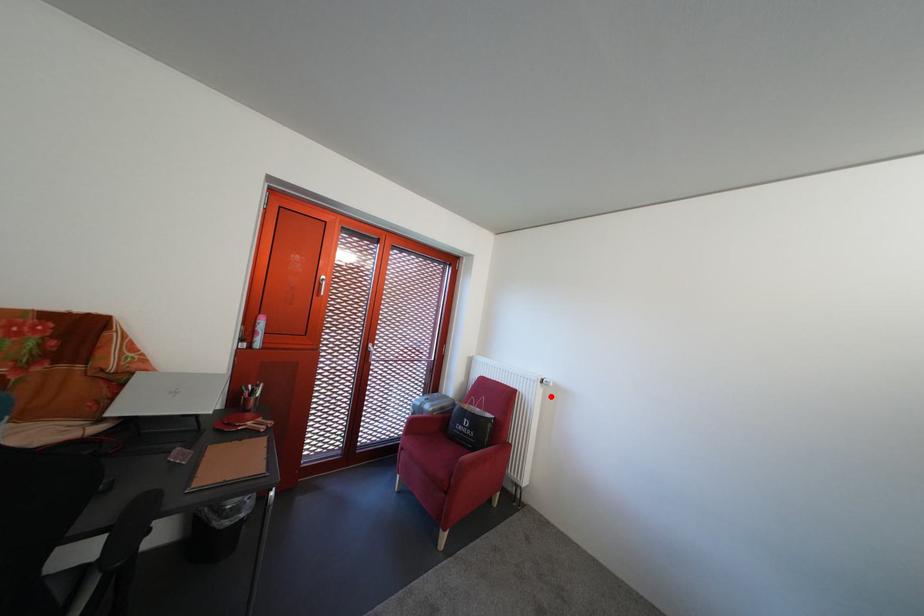
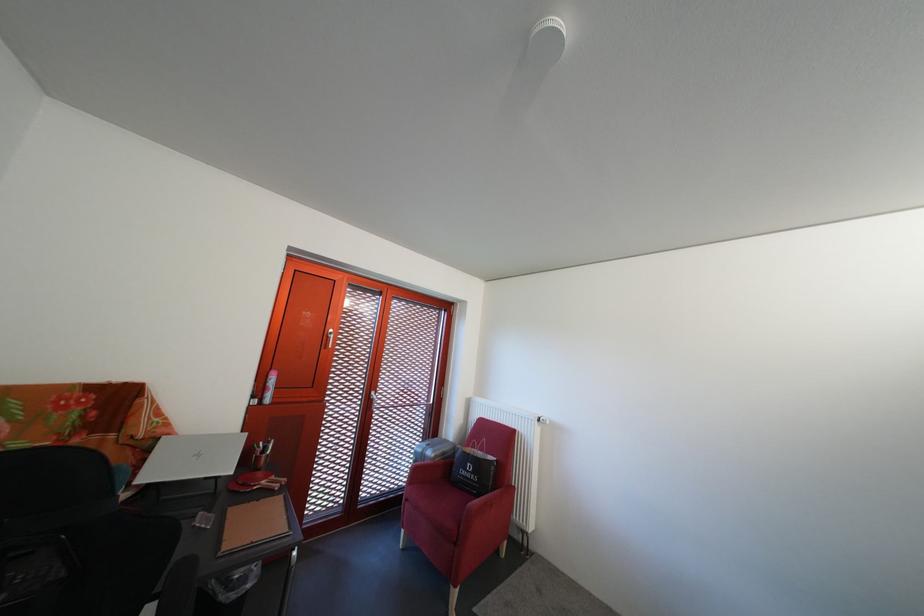
In the second image, find the point that corresponds to the highlighted location in the first image.

(549, 436)